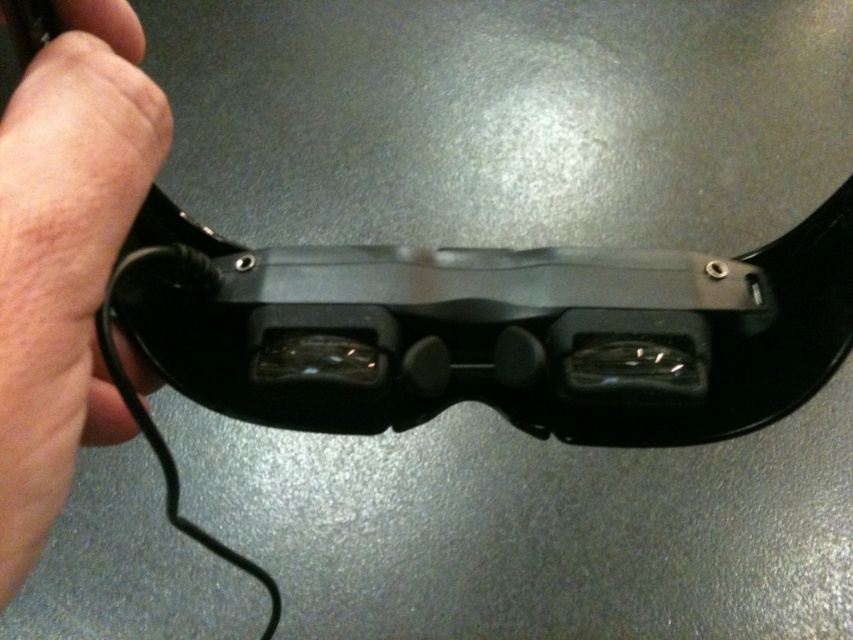
Question: Is the position of black plastic goggles at center more distant than that of pinky skin at lower left?

Choices:
 (A) no
 (B) yes

Answer: (B)

Question: Which point is closer to the camera?

Choices:
 (A) black plastic goggles at center
 (B) pinky skin at lower left

Answer: (B)

Question: Can you confirm if black plastic goggles at center is positioned to the right of pinky skin at lower left?

Choices:
 (A) yes
 (B) no

Answer: (A)

Question: Observing the image, what is the correct spatial positioning of black plastic goggles at center in reference to pinky skin at lower left?

Choices:
 (A) below
 (B) above

Answer: (A)

Question: Which object appears closest to the camera in this image?

Choices:
 (A) pinky skin at lower left
 (B) black plastic goggles at center

Answer: (A)